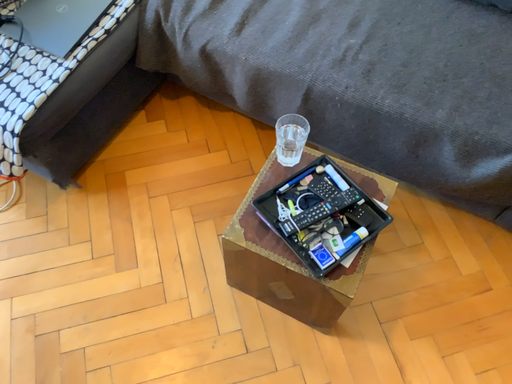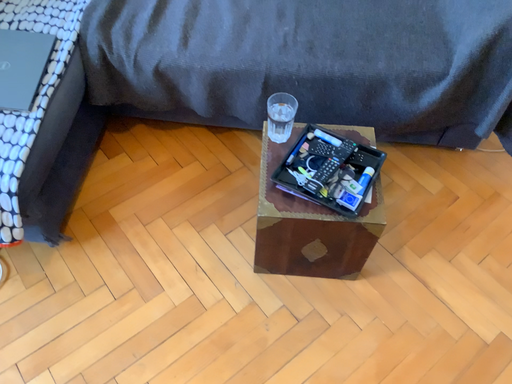
Question: How did the camera likely rotate when shooting the video?

Choices:
 (A) rotated right
 (B) rotated left

Answer: (A)